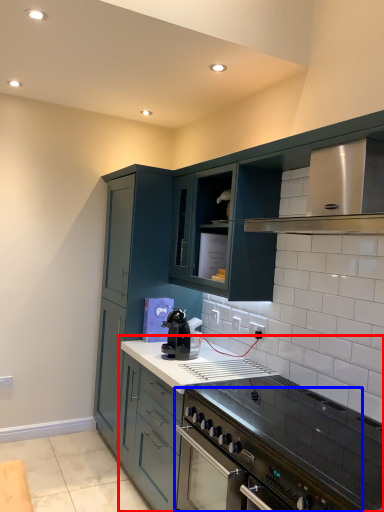
Question: Which point is further to the camera, countertop (highlighted by a red box) or kitchen appliance (highlighted by a blue box)?

Choices:
 (A) countertop
 (B) kitchen appliance

Answer: (A)